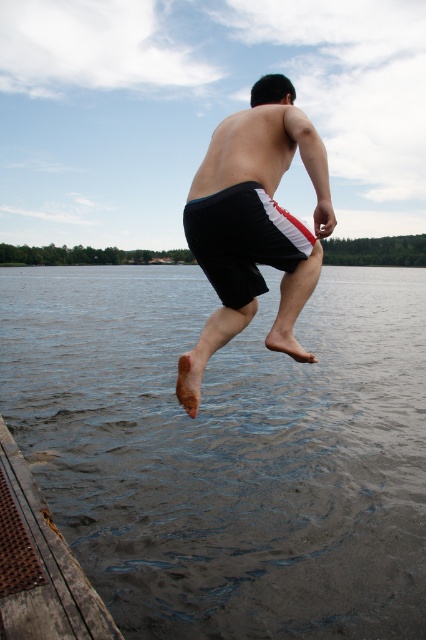
Question: Does rusty wood dock at lower left appear on the left side of black fabric shorts at center?

Choices:
 (A) yes
 (B) no

Answer: (A)

Question: Which of the following is the farthest from the observer?

Choices:
 (A) (187, 241)
 (B) (242, 301)
 (C) (287, 600)
 (D) (28, 577)

Answer: (C)

Question: Is the position of black cotton shorts at center more distant than that of black fabric shorts at center?

Choices:
 (A) no
 (B) yes

Answer: (B)

Question: Does dark gray water at lower center appear on the left side of black fabric shorts at center?

Choices:
 (A) no
 (B) yes

Answer: (A)

Question: Based on their relative distances, which object is nearer to the dark gray water at lower center?

Choices:
 (A) rusty wood dock at lower left
 (B) black fabric shorts at center
 (C) black cotton shorts at center

Answer: (B)

Question: Among these points, which one is nearest to the camera?

Choices:
 (A) (91, 637)
 (B) (353, 532)

Answer: (A)